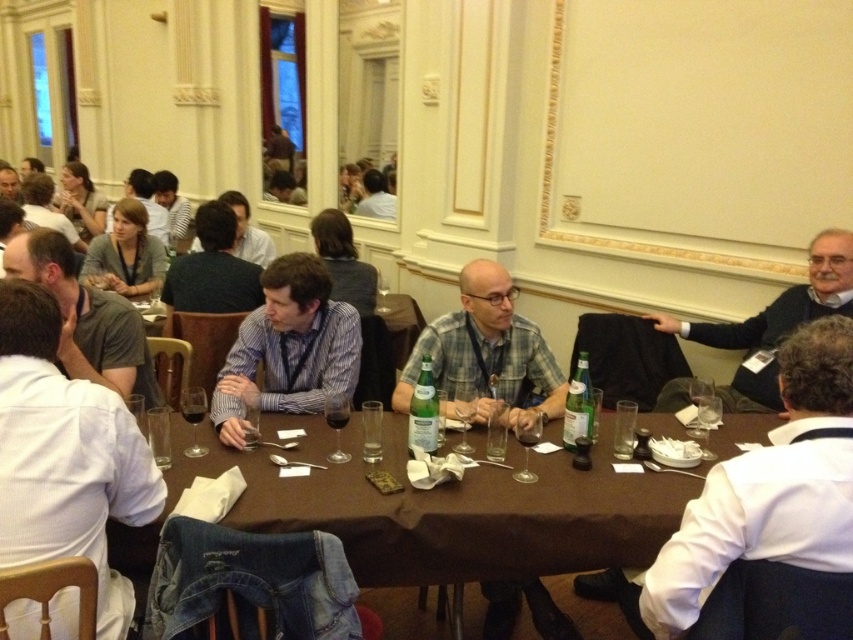
Does blue striped shirt at center appear over gray shirt at left?

No.

Between point (219, 435) and point (21, 240), which one is positioned in front?

Point (219, 435) is more forward.

At what (x,y) coordinates should I click in order to perform the action: click on blue striped shirt at center. Please return your answer as a coordinate pair (x, y). Image resolution: width=853 pixels, height=640 pixels. Looking at the image, I should click on (288, 348).

Who is more forward, (199, 280) or (265, 257)?

Point (199, 280)

Does dark brown hair at center appear under matte blue shirt at center?

Indeed, dark brown hair at center is positioned under matte blue shirt at center.

Where is `dark brown hair at center`? The height and width of the screenshot is (640, 853). dark brown hair at center is located at coordinates (212, 268).

Is brown fabric table at center positioned behind gray shirt at left?

No, it is not.

The height and width of the screenshot is (640, 853). What do you see at coordinates (456, 513) in the screenshot? I see `brown fabric table at center` at bounding box center [456, 513].

The width and height of the screenshot is (853, 640). I want to click on brown fabric table at center, so click(456, 513).